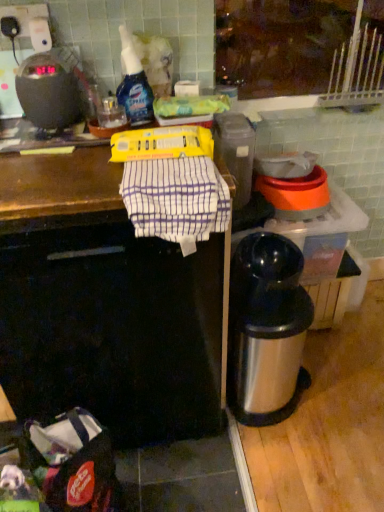
Where is `free point above white striped cloth at center (from a real-world perspective)`? The image size is (384, 512). free point above white striped cloth at center (from a real-world perspective) is located at coordinates point(174,168).